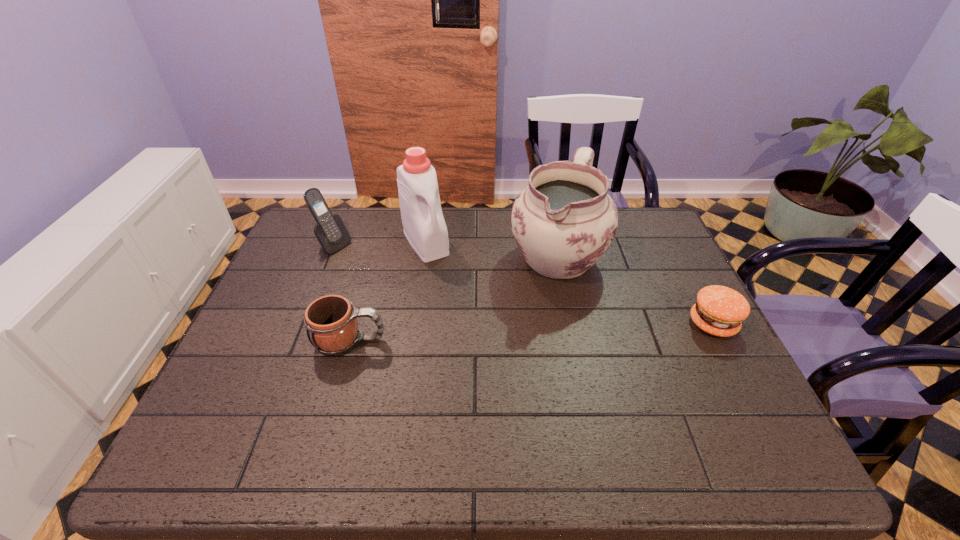
The height and width of the screenshot is (540, 960). In order to click on vacant space that is in between the pitcher and the patty in this screenshot , I will do `click(635, 289)`.

Locate an element on the screen. The height and width of the screenshot is (540, 960). free space between the pitcher and the detergent is located at coordinates (492, 249).

Find the location of `blank region between the cellular telephone and the detergent`. blank region between the cellular telephone and the detergent is located at coordinates (379, 244).

Where is `vacant space that is in between the fourth object from left to right and the rightmost object`? The height and width of the screenshot is (540, 960). vacant space that is in between the fourth object from left to right and the rightmost object is located at coordinates (635, 289).

Find the location of a particular element. The image size is (960, 540). free area in between the rightmost object and the third shortest object is located at coordinates (523, 285).

At what (x,y) coordinates should I click in order to perform the action: click on empty space between the pitcher and the patty. Please return your answer as a coordinate pair (x, y). Looking at the image, I should click on (635, 289).

Point out which object is positioned as the nearest to the fourth object from left to right. Please provide its 2D coordinates. Your answer should be formatted as a tuple, i.e. [(x, y)], where the tuple contains the x and y coordinates of a point satisfying the conditions above.

[(719, 310)]

You are a GUI agent. You are given a task and a screenshot of the screen. Output one action in this format:
    pyautogui.click(x=<x>, y=<y>)
    Task: Click on the fourth closest object relative to the third tallest object
    The width and height of the screenshot is (960, 540).
    Given the screenshot: What is the action you would take?
    pyautogui.click(x=719, y=310)

Locate an element on the screen. blank area in the image that satisfies the following two spatial constraints: 1. on the front side of the third tallest object; 2. on the right side of the patty is located at coordinates (301, 323).

At what (x,y) coordinates should I click in order to perform the action: click on vacant area in the image that satisfies the following two spatial constraints: 1. on the back side of the detergent; 2. on the left side of the third tallest object. Please return your answer as a coordinate pair (x, y). The width and height of the screenshot is (960, 540). Looking at the image, I should click on (334, 242).